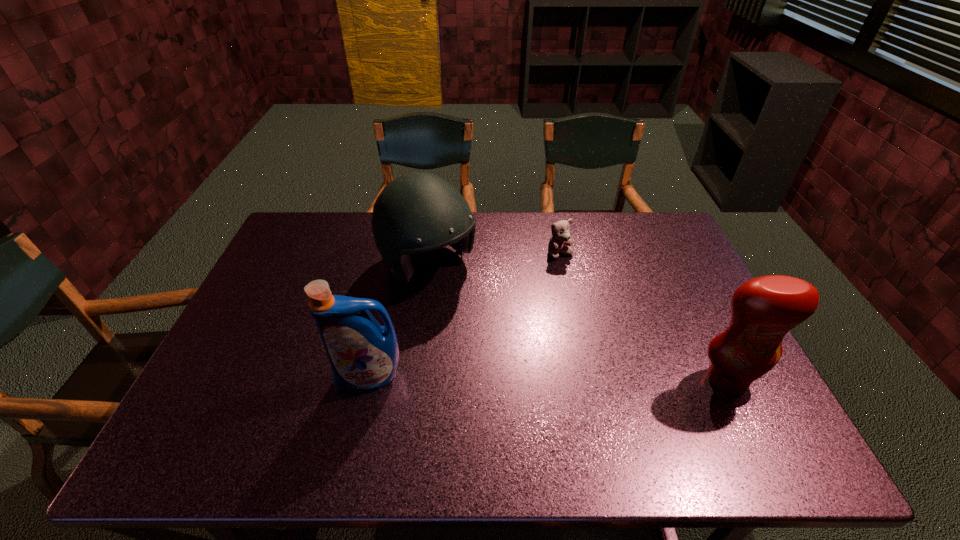
Find the location of a particular element. This screenshot has height=540, width=960. vacant space located 0.350m at the face opening of the football helmet is located at coordinates (540, 369).

Identify the location of teddy bear positioned at the far edge. The image size is (960, 540). (559, 242).

Where is `football helmet at the far edge`? football helmet at the far edge is located at coordinates (417, 212).

You are a GUI agent. You are given a task and a screenshot of the screen. Output one action in this format:
    pyautogui.click(x=<x>, y=<y>)
    Task: Click on the detergent present at the near edge
    This screenshot has height=540, width=960.
    Given the screenshot: What is the action you would take?
    pyautogui.click(x=364, y=356)

In order to click on condiment positioned at the near edge in this screenshot , I will do `click(763, 310)`.

At what (x,y) coordinates should I click in order to perform the action: click on object at the right edge. Please return your answer as a coordinate pair (x, y). The width and height of the screenshot is (960, 540). Looking at the image, I should click on (763, 310).

You are a GUI agent. You are given a task and a screenshot of the screen. Output one action in this format:
    pyautogui.click(x=<x>, y=<y>)
    Task: Click on the object located in the near right corner section of the desktop
    This screenshot has width=960, height=540.
    Given the screenshot: What is the action you would take?
    pyautogui.click(x=763, y=310)

Image resolution: width=960 pixels, height=540 pixels. Identify the location of vacant area at the far edge. (368, 239).

You are a GUI agent. You are given a task and a screenshot of the screen. Output one action in this format:
    pyautogui.click(x=<x>, y=<y>)
    Task: Click on the free space at the near edge of the desktop
    The image size is (960, 540).
    Given the screenshot: What is the action you would take?
    point(457,393)

This screenshot has height=540, width=960. In the image, there is a desktop. Identify the location of blank space at the left edge. (242, 383).